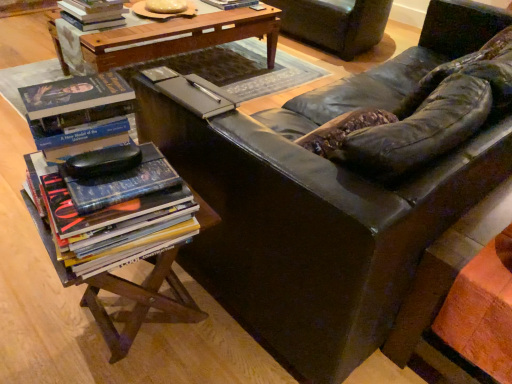
The height and width of the screenshot is (384, 512). Describe the element at coordinates (140, 304) in the screenshot. I see `woodenmaterial/texturetable at lower left, arranged as the first table when viewed from the front` at that location.

In order to face wooden table at center, the 2th table in the bottom-to-top sequence, should I rotate leftwards or rightwards?

Rotate left and turn 11.186 degrees.

In the scene shown: What is the approximate width of hardcover book at upper left, which is the second book in bottom-to-top order?

hardcover book at upper left, which is the second book in bottom-to-top order, is 14.28 inches in width.

What do you see at coordinates (231, 3) in the screenshot? I see `hardcover book at upper center, positioned as the 3th book in bottom-to-top order` at bounding box center [231, 3].

At what (x,y) coordinates should I click in order to perform the action: click on velvet dark brown armchair at upper center. Please return your answer as a coordinate pair (x, y). This screenshot has height=384, width=512. Looking at the image, I should click on (335, 23).

Image resolution: width=512 pixels, height=384 pixels. In order to click on hardcover books at left, which ranks as the second book in right-to-left order in this screenshot , I will do `click(113, 215)`.

From the picture: Is woodenmaterial/texturetable at lower left, the first table in the bottom-to-top sequence, wider than velvet dark brown armchair at upper center?

Incorrect, the width of woodenmaterial/texturetable at lower left, the first table in the bottom-to-top sequence, does not surpass that of velvet dark brown armchair at upper center.

Is woodenmaterial/texturetable at lower left, arranged as the first table when viewed from the front, turned away from velvet dark brown armchair at upper center?

No, woodenmaterial/texturetable at lower left, arranged as the first table when viewed from the front, is not facing the opposite direction of velvet dark brown armchair at upper center.

Based on the photo, can you confirm if woodenmaterial/texturetable at lower left, marked as the 2th table in a top-to-bottom arrangement, is shorter than velvet dark brown armchair at upper center?

Correct, woodenmaterial/texturetable at lower left, marked as the 2th table in a top-to-bottom arrangement, is not as tall as velvet dark brown armchair at upper center.

Can you tell me how much woodenmaterial/texturetable at lower left, marked as the second table in a back-to-front arrangement, and velvet dark brown armchair at upper center differ in facing direction?

The angle between the facing direction of woodenmaterial/texturetable at lower left, marked as the second table in a back-to-front arrangement, and the facing direction of velvet dark brown armchair at upper center is 95.2 degrees.

Is there a large distance between hardcover book at upper left, marked as the 1th book in a left-to-right arrangement, and wooden table at center, which appears as the 1th table when viewed from the top?

No.

Considering the sizes of objects hardcover book at upper left, which is the second book in bottom-to-top order, and wooden table at center, the 2th table in the bottom-to-top sequence, in the image provided, who is thinner, hardcover book at upper left, which is the second book in bottom-to-top order, or wooden table at center, the 2th table in the bottom-to-top sequence,?

hardcover book at upper left, which is the second book in bottom-to-top order.

Considering the sizes of hardcover book at upper left, the third book from the right, and wooden table at center, positioned as the second table in front-to-back order, in the image, is hardcover book at upper left, the third book from the right, bigger or smaller than wooden table at center, positioned as the second table in front-to-back order,?

Clearly, hardcover book at upper left, the third book from the right, is smaller in size than wooden table at center, positioned as the second table in front-to-back order.

From the hardcover book at upper left, placed as the second book when sorted from front to back, count 2nd table to the right and point to it. Please provide its 2D coordinates.

[(140, 304)]

Is the position of woodenmaterial/texturetable at lower left, marked as the 2th table in a top-to-bottom arrangement, more distant than that of hardcover book at upper left, positioned as the second book in top-to-bottom order?

No.

How distant is woodenmaterial/texturetable at lower left, arranged as the first table when viewed from the front, from hardcover book at upper left, placed as the second book when sorted from front to back?

5.63 feet.

How different are the orientations of hardcover book at upper center, positioned as the 3th book in bottom-to-top order, and matte brown book at center in degrees?

178 degrees separate the facing orientations of hardcover book at upper center, positioned as the 3th book in bottom-to-top order, and matte brown book at center.

Considering the sizes of hardcover book at upper center, positioned as the third book in left-to-right order, and matte brown book at center in the image, is hardcover book at upper center, positioned as the third book in left-to-right order, bigger or smaller than matte brown book at center?

In the image, hardcover book at upper center, positioned as the third book in left-to-right order, appears to be larger than matte brown book at center.

Can you confirm if hardcover book at upper center, arranged as the first book when viewed from the back, is taller than matte brown book at center?

Indeed, hardcover book at upper center, arranged as the first book when viewed from the back, has a greater height compared to matte brown book at center.

Which object is positioned more to the left, hardcover book at upper center, positioned as the 3th book in bottom-to-top order, or matte brown book at center?

From the viewer's perspective, hardcover book at upper center, positioned as the 3th book in bottom-to-top order, appears more on the left side.

Can you confirm if velvet dark brown armchair at upper center is thinner than matte brown book at center?

Incorrect, the width of velvet dark brown armchair at upper center is not less than that of matte brown book at center.

Could you tell me if velvet dark brown armchair at upper center is facing matte brown book at center?

Yes, velvet dark brown armchair at upper center is facing matte brown book at center.

Which of these two, velvet dark brown armchair at upper center or matte brown book at center, is bigger?

velvet dark brown armchair at upper center.

From the image's perspective, would you say hardcover books at left, which is the 2th book in left-to-right order, is shown under wooden table at center, positioned as the second table in front-to-back order?

Yes, from the image's perspective, hardcover books at left, which is the 2th book in left-to-right order, is beneath wooden table at center, positioned as the second table in front-to-back order.

Is point (170, 231) in front of point (271, 17)?

Yes, point (170, 231) is in front of point (271, 17).

Is hardcover books at left, which ranks as the second book in right-to-left order, oriented away from wooden table at center, the 2th table in the bottom-to-top sequence?

hardcover books at left, which ranks as the second book in right-to-left order, is not turned away from wooden table at center, the 2th table in the bottom-to-top sequence.

Looking at this image, does hardcover books at left, the third book viewed from the back, lie in front of wooden table at center, which is the 1th table from back to front?

Yes, hardcover books at left, the third book viewed from the back, is closer to the camera.

Could you measure the distance between matte black leather couch at center and hardcover book at upper left, the third book from the right?

matte black leather couch at center and hardcover book at upper left, the third book from the right, are 1.69 meters apart.

In the scene shown: Considering the relative sizes of matte black leather couch at center and hardcover book at upper left, which is the 2th book from back to front, in the image provided, is matte black leather couch at center taller than hardcover book at upper left, which is the 2th book from back to front,?

Correct, matte black leather couch at center is much taller as hardcover book at upper left, which is the 2th book from back to front.

In terms of width, does matte black leather couch at center look wider or thinner when compared to hardcover book at upper left, which is the 2th book from back to front?

Considering their sizes, matte black leather couch at center looks broader than hardcover book at upper left, which is the 2th book from back to front.

From the image's perspective, relative to hardcover book at upper left, marked as the 1th book in a left-to-right arrangement, is matte black leather couch at center above or below?

matte black leather couch at center is situated lower than hardcover book at upper left, marked as the 1th book in a left-to-right arrangement, in the image.

Where is `chair above the woodenmaterial/texturetable at lower left, arranged as the first table when viewed from the front (from the image's perspective)`? The width and height of the screenshot is (512, 384). chair above the woodenmaterial/texturetable at lower left, arranged as the first table when viewed from the front (from the image's perspective) is located at coordinates (335, 23).

The height and width of the screenshot is (384, 512). Find the location of `table that is the 1st object located below the hardcover book at upper left, which is the second book in bottom-to-top order (from the image's perspective)`. table that is the 1st object located below the hardcover book at upper left, which is the second book in bottom-to-top order (from the image's perspective) is located at coordinates (179, 37).

Which object lies further to the anchor point woodenmaterial/texturetable at lower left, marked as the 2th table in a top-to-bottom arrangement, matte black leather couch at center or velvet dark brown armchair at upper center?

velvet dark brown armchair at upper center is positioned further to the anchor woodenmaterial/texturetable at lower left, marked as the 2th table in a top-to-bottom arrangement.

When comparing their distances from matte black leather couch at center, does woodenmaterial/texturetable at lower left, marked as the 2th table in a top-to-bottom arrangement, or wooden table at center, the 2th table in the bottom-to-top sequence, seem further?

Among the two, wooden table at center, the 2th table in the bottom-to-top sequence, is located further to matte black leather couch at center.

Consider the image. Which object lies further to the anchor point hardcover book at upper left, the third book from the right, matte brown book at center or wooden table at center, the 2th table in the bottom-to-top sequence?

The object further to hardcover book at upper left, the third book from the right, is matte brown book at center.

Looking at the image, which one is located further to hardcover books at left, which ranks as the second book in right-to-left order, matte brown book at center or matte black leather couch at center?

Among the two, matte brown book at center is located further to hardcover books at left, which ranks as the second book in right-to-left order.

Estimate the real-world distances between objects in this image. Which object is further from hardcover book at upper left, placed as the second book when sorted from front to back, matte black leather couch at center or velvet dark brown armchair at upper center?

The object further to hardcover book at upper left, placed as the second book when sorted from front to back, is matte black leather couch at center.

Considering their positions, is hardcover book at upper left, positioned as the second book in top-to-bottom order, positioned closer to woodenmaterial/texturetable at lower left, marked as the 2th table in a top-to-bottom arrangement, than velvet dark brown armchair at upper center?

The object closer to woodenmaterial/texturetable at lower left, marked as the 2th table in a top-to-bottom arrangement, is hardcover book at upper left, positioned as the second book in top-to-bottom order.

Estimate the real-world distances between objects in this image. Which object is closer to hardcover books at left, placed as the first book when sorted from bottom to top, matte brown book at center or wooden table at center, the 2th table in the bottom-to-top sequence?

matte brown book at center is positioned closer to the anchor hardcover books at left, placed as the first book when sorted from bottom to top.

Considering their positions, is matte brown book at center positioned further to woodenmaterial/texturetable at lower left, marked as the second table in a back-to-front arrangement, than wooden table at center, which is the 1th table from back to front?

Based on the image, wooden table at center, which is the 1th table from back to front, appears to be further to woodenmaterial/texturetable at lower left, marked as the second table in a back-to-front arrangement.

Where is `paperback book between matte black leather couch at center and hardcover book at upper left, marked as the 1th book in a left-to-right arrangement, along the z-axis`? The width and height of the screenshot is (512, 384). paperback book between matte black leather couch at center and hardcover book at upper left, marked as the 1th book in a left-to-right arrangement, along the z-axis is located at coordinates (197, 95).

Find the location of a particular element. This screenshot has height=384, width=512. paperback book situated between woodenmaterial/texturetable at lower left, marked as the second table in a back-to-front arrangement, and matte black leather couch at center from left to right is located at coordinates (197, 95).

Find the location of a particular element. Image resolution: width=512 pixels, height=384 pixels. paperback book between hardcover books at left, which is the 2th book in left-to-right order, and velvet dark brown armchair at upper center, along the z-axis is located at coordinates (197, 95).

The height and width of the screenshot is (384, 512). I want to click on book between matte black leather couch at center and hardcover book at upper left, the third book from the right, from front to back, so click(113, 215).